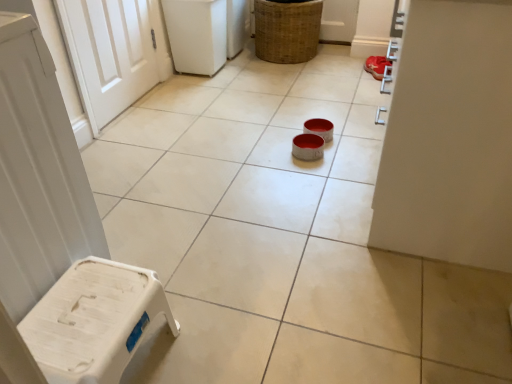
The height and width of the screenshot is (384, 512). I want to click on free area behind red suede shoe at upper right, so click(348, 66).